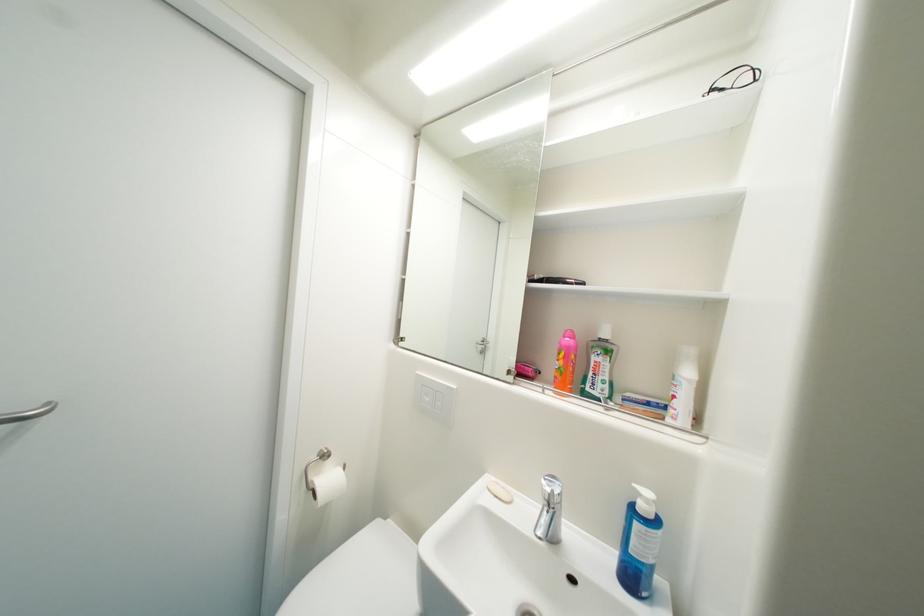
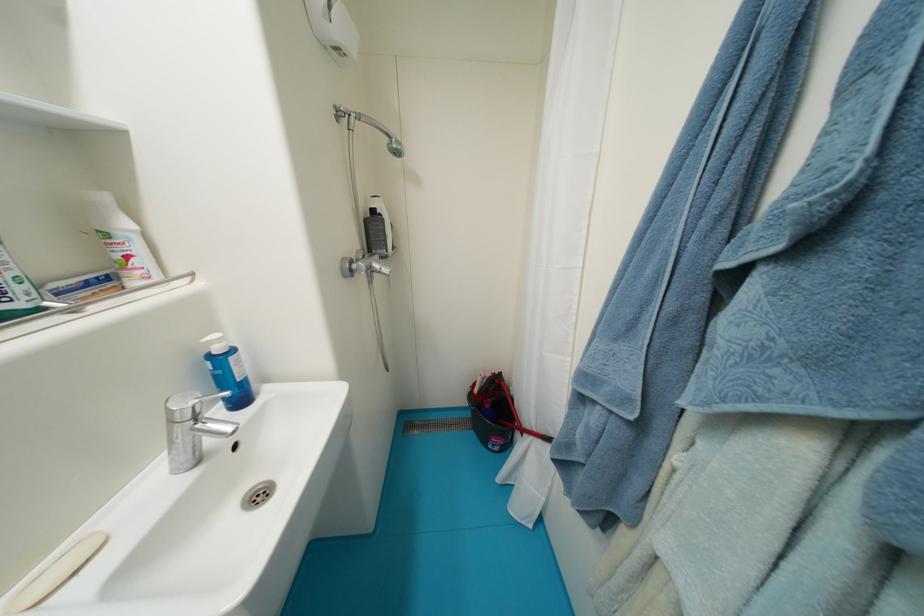
Locate, in the second image, the point that corresponds to point (635, 397) in the first image.

(61, 286)